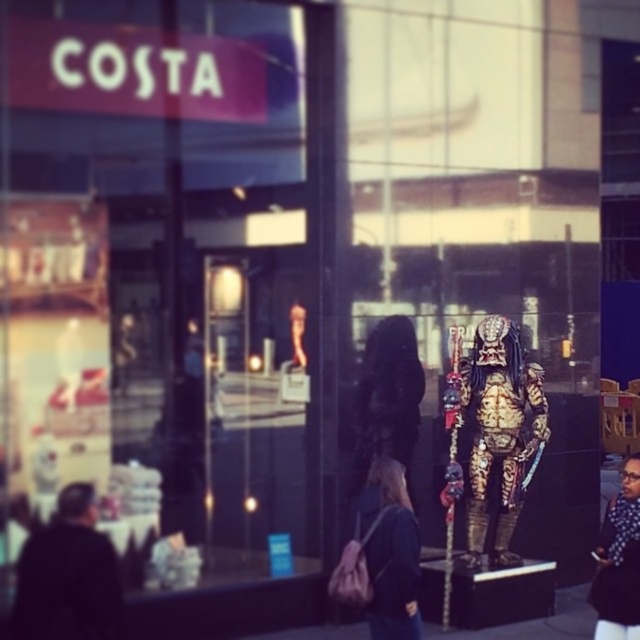
Question: Which object is farther from the camera taking this photo?

Choices:
 (A) gold metallic predator at center
 (B) matte black jacket at center

Answer: (A)

Question: Can you confirm if gold metallic predator at center is wider than dark blue fabric jacket at lower right?

Choices:
 (A) yes
 (B) no

Answer: (A)

Question: Which point appears closest to the camera in this image?

Choices:
 (A) (387, 563)
 (B) (625, 502)
 (C) (470, 394)

Answer: (B)

Question: Does gold metallic predator at center have a greater width compared to dark blue fabric jacket at lower right?

Choices:
 (A) no
 (B) yes

Answer: (B)

Question: Can you confirm if gold metallic predator at center is bigger than matte black jacket at center?

Choices:
 (A) no
 (B) yes

Answer: (B)

Question: Which object is closer to the camera taking this photo?

Choices:
 (A) dark blue fabric jacket at lower right
 (B) gold metallic predator at center

Answer: (A)